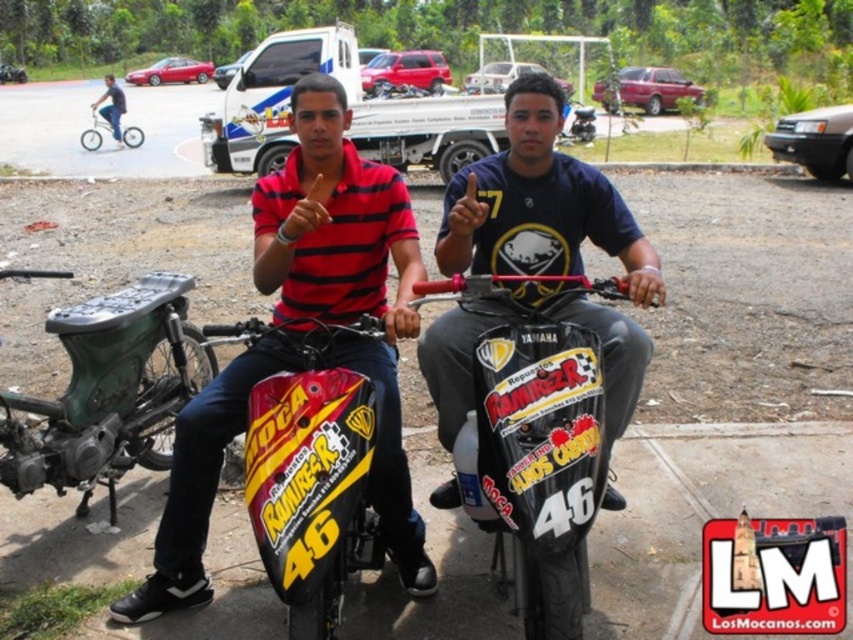
Question: Is black matte motorcycle at center to the left of silver metallic bicycle at upper left from the viewer's perspective?

Choices:
 (A) yes
 (B) no

Answer: (B)

Question: Can you confirm if shiny red motorcycle at center is bigger than blue jeans at lower left?

Choices:
 (A) yes
 (B) no

Answer: (B)

Question: Does black matte shirt at center have a larger size compared to shiny red motorcycle at center?

Choices:
 (A) no
 (B) yes

Answer: (B)

Question: Among these points, which one is farthest from the camera?

Choices:
 (A) (473, 292)
 (B) (119, 113)

Answer: (B)

Question: Which point is farther to the camera?

Choices:
 (A) (494, 252)
 (B) (120, 141)

Answer: (B)

Question: Which point is closer to the camera?

Choices:
 (A) (106, 90)
 (B) (349, 241)

Answer: (B)